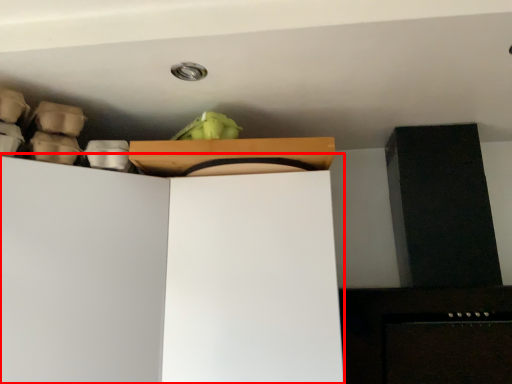
Question: From the image, what is the correct spatial relationship of cabinetry (annotated by the red box) in relation to cardboard box?

Choices:
 (A) right
 (B) left

Answer: (B)